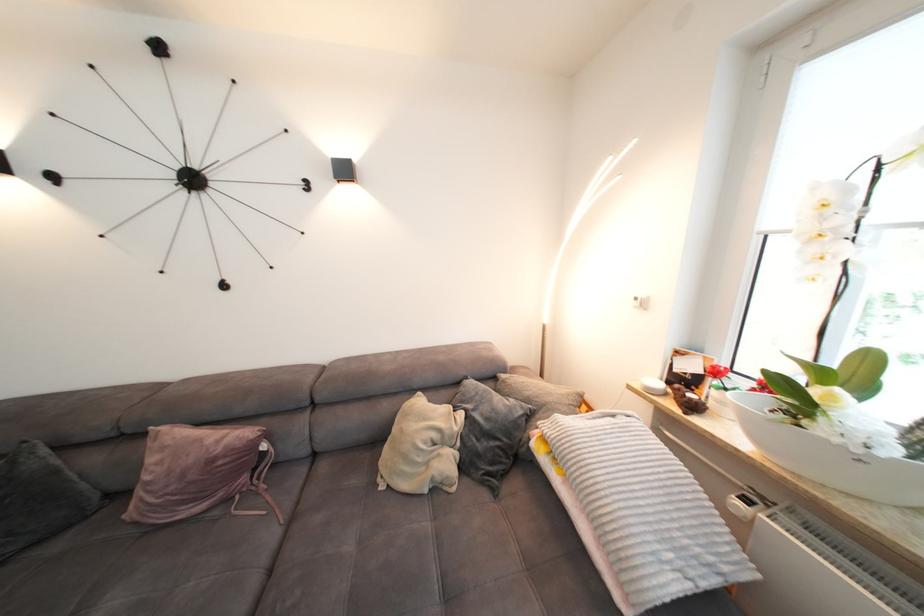
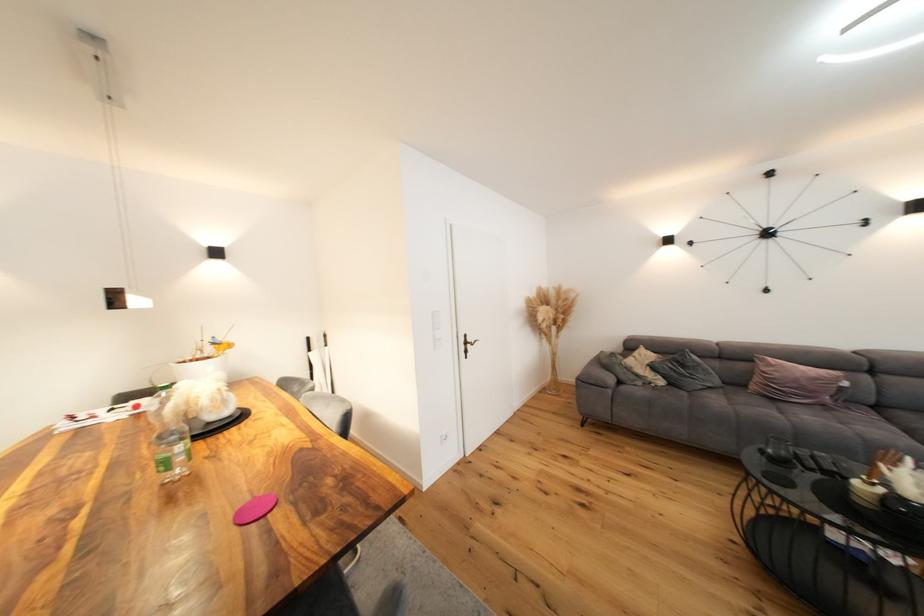
Where in the second image is the point corresponding to (219,463) from the first image?

(822, 381)